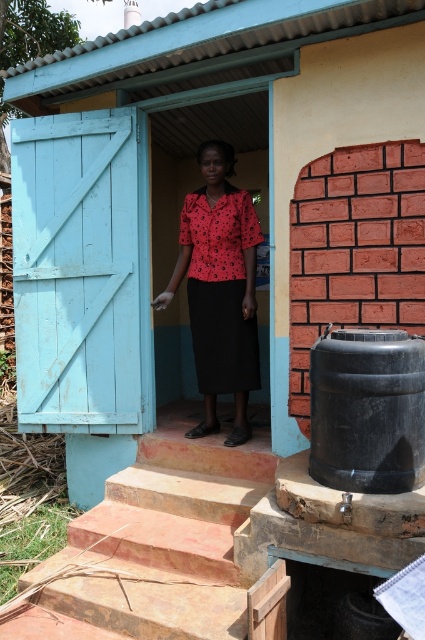
What are the coordinates of `black plastic barrel at lower right` in the screenshot? It's located at (367, 410).

At what (x,y) coordinates should I click in order to perform the action: click on black plastic barrel at lower right. Please return your answer as a coordinate pair (x, y). The height and width of the screenshot is (640, 425). Looking at the image, I should click on (367, 410).

Does terracotta stone stairs at center appear under red floral blouse at center?

Indeed, terracotta stone stairs at center is positioned under red floral blouse at center.

Which is in front, point (195, 536) or point (249, 218)?

Point (195, 536) is in front.

Measure the distance between terracotta stone stairs at center and camera.

8.19 feet

Where is `terracotta stone stairs at center`? The height and width of the screenshot is (640, 425). terracotta stone stairs at center is located at coordinates (153, 547).

Who is lower down, terracotta stone stairs at center or black plastic barrel at lower right?

terracotta stone stairs at center is below.

This screenshot has width=425, height=640. Identify the location of terracotta stone stairs at center. (153, 547).

Where is `terracotta stone stairs at center`? The image size is (425, 640). terracotta stone stairs at center is located at coordinates (153, 547).

Find the location of `terracotta stone stairs at center`. terracotta stone stairs at center is located at coordinates (153, 547).